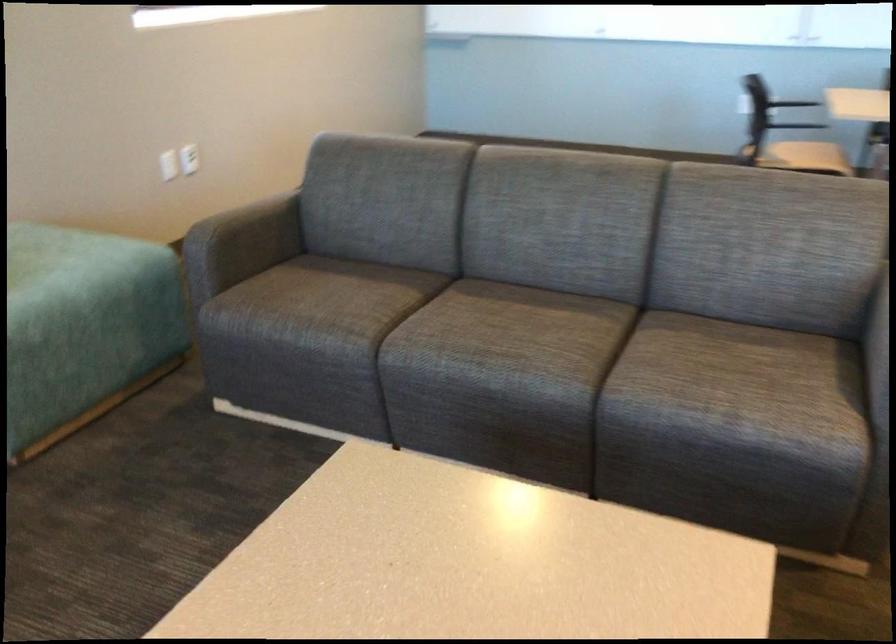
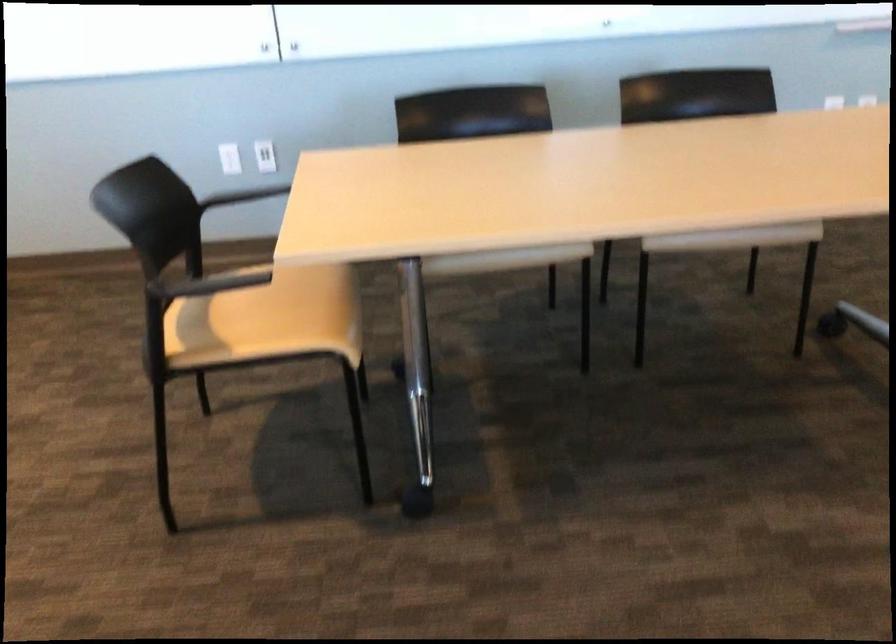
In a continuous first-person perspective shot, in which direction is the camera moving?

The cameraman walked toward right, forward.